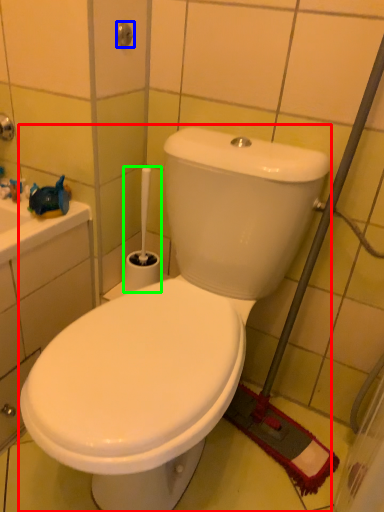
Question: Estimate the real-world distances between objects in this image. Which object is closer to toilet (highlighted by a red box), shower (highlighted by a blue box) or brush (highlighted by a green box)?

Choices:
 (A) shower
 (B) brush

Answer: (B)